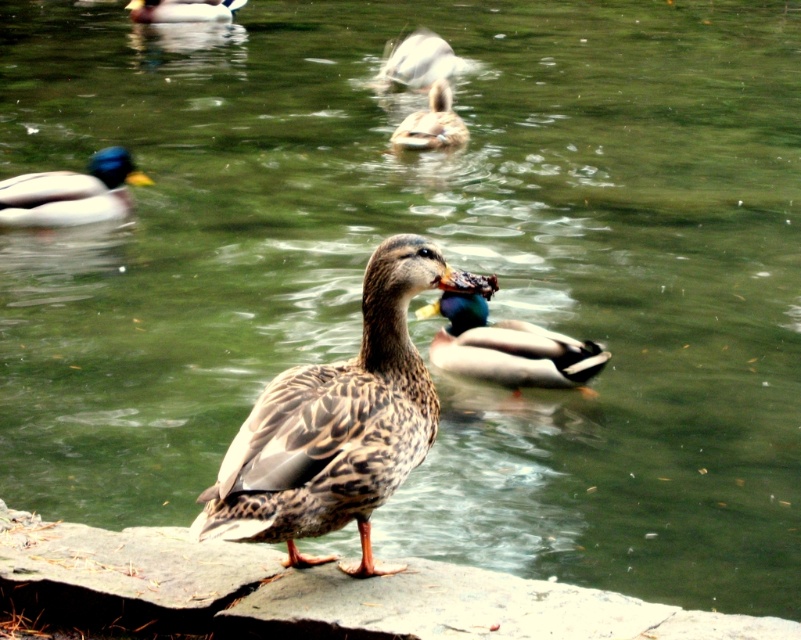
Question: Does brown speckled feathers at center have a larger size compared to shiny green drake at left?

Choices:
 (A) no
 (B) yes

Answer: (B)

Question: Which point is closer to the camera?

Choices:
 (A) speckled feathered duck at upper center
 (B) brown speckled feathers at upper center

Answer: (B)

Question: Can you confirm if shiny green drake at left is positioned below brown speckled feathers at upper left?

Choices:
 (A) yes
 (B) no

Answer: (A)

Question: From the image, what is the correct spatial relationship of shiny green drake at left in relation to brown speckled feathers at upper left?

Choices:
 (A) left
 (B) right

Answer: (B)

Question: Which point is closer to the camera?

Choices:
 (A) (520, 342)
 (B) (397, 76)
 (C) (325, 483)
 (D) (453, 136)

Answer: (C)

Question: Which of the following is the closest to the observer?

Choices:
 (A) tap(182, 3)
 (B) tap(401, 65)
 (C) tap(441, 99)

Answer: (C)